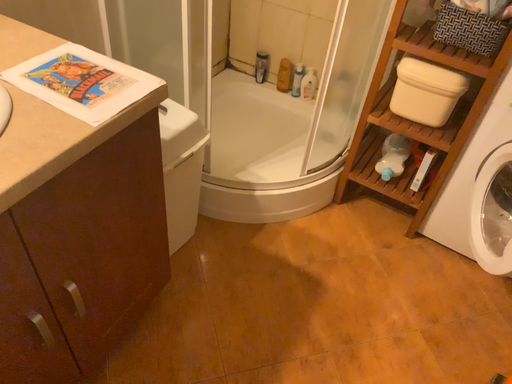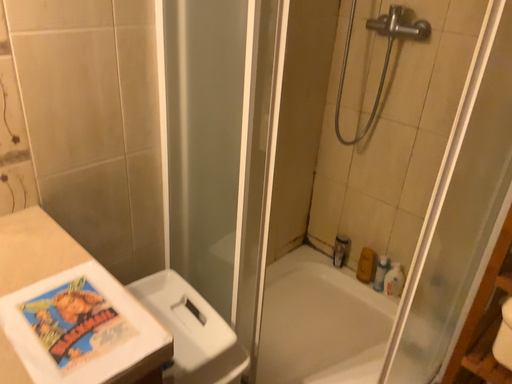
Question: Which way did the camera rotate in the video?

Choices:
 (A) rotated left
 (B) rotated right

Answer: (A)